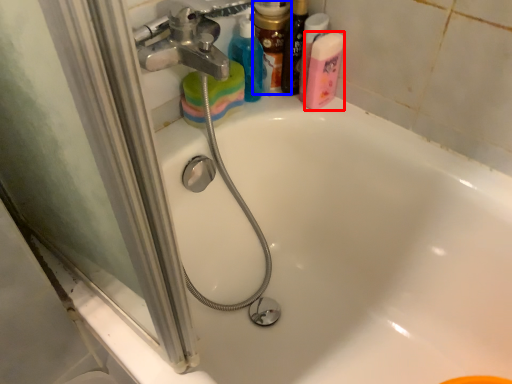
Question: Which point is further to the camera, cleaning product (highlighted by a red box) or toiletry (highlighted by a blue box)?

Choices:
 (A) cleaning product
 (B) toiletry

Answer: (B)